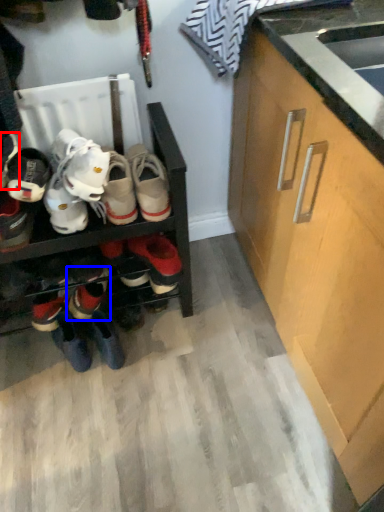
Question: Among these objects, which one is farthest to the camera, footwear (highlighted by a red box) or footwear (highlighted by a blue box)?

Choices:
 (A) footwear
 (B) footwear

Answer: (B)